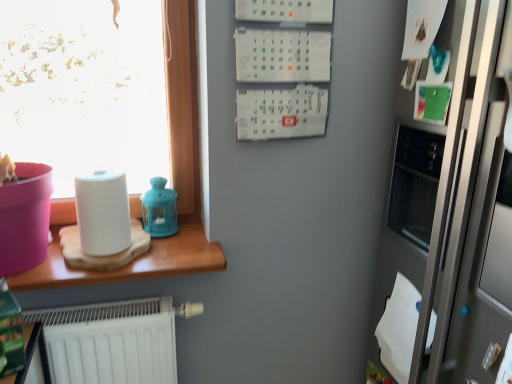
Question: Considering the relative sizes of wooden table at left and satin silver fridge at right in the image provided, is wooden table at left bigger than satin silver fridge at right?

Choices:
 (A) yes
 (B) no

Answer: (B)

Question: Is wooden table at left positioned behind satin silver fridge at right?

Choices:
 (A) no
 (B) yes

Answer: (B)

Question: Is wooden table at left at the right side of satin silver fridge at right?

Choices:
 (A) yes
 (B) no

Answer: (B)

Question: Does wooden table at left have a smaller size compared to satin silver fridge at right?

Choices:
 (A) yes
 (B) no

Answer: (A)

Question: Are wooden table at left and satin silver fridge at right far apart?

Choices:
 (A) yes
 (B) no

Answer: (B)

Question: From a real-world perspective, is matte blue lantern at upper center physically located above or below satin silver fridge at right?

Choices:
 (A) above
 (B) below

Answer: (A)

Question: Relative to satin silver fridge at right, is matte blue lantern at upper center in front or behind?

Choices:
 (A) behind
 (B) front

Answer: (A)

Question: Choose the correct answer: Is matte blue lantern at upper center inside satin silver fridge at right or outside it?

Choices:
 (A) outside
 (B) inside

Answer: (A)

Question: In the image, is matte blue lantern at upper center on the left side or the right side of satin silver fridge at right?

Choices:
 (A) left
 (B) right

Answer: (A)

Question: Is point (160, 210) positioned closer to the camera than point (122, 173)?

Choices:
 (A) farther
 (B) closer

Answer: (A)

Question: Looking at the image, does matte blue lantern at upper center seem bigger or smaller compared to white matte paper towel at left?

Choices:
 (A) small
 (B) big

Answer: (A)

Question: Would you say matte blue lantern at upper center is to the left or to the right of white matte paper towel at left in the picture?

Choices:
 (A) right
 (B) left

Answer: (A)

Question: Is matte blue lantern at upper center inside the boundaries of white matte paper towel at left, or outside?

Choices:
 (A) outside
 (B) inside

Answer: (A)

Question: Does point (118, 183) appear closer or farther from the camera than point (507, 231)?

Choices:
 (A) farther
 (B) closer

Answer: (A)

Question: From their relative heights in the image, would you say white matte paper towel at left is taller or shorter than satin silver fridge at right?

Choices:
 (A) tall
 (B) short

Answer: (B)